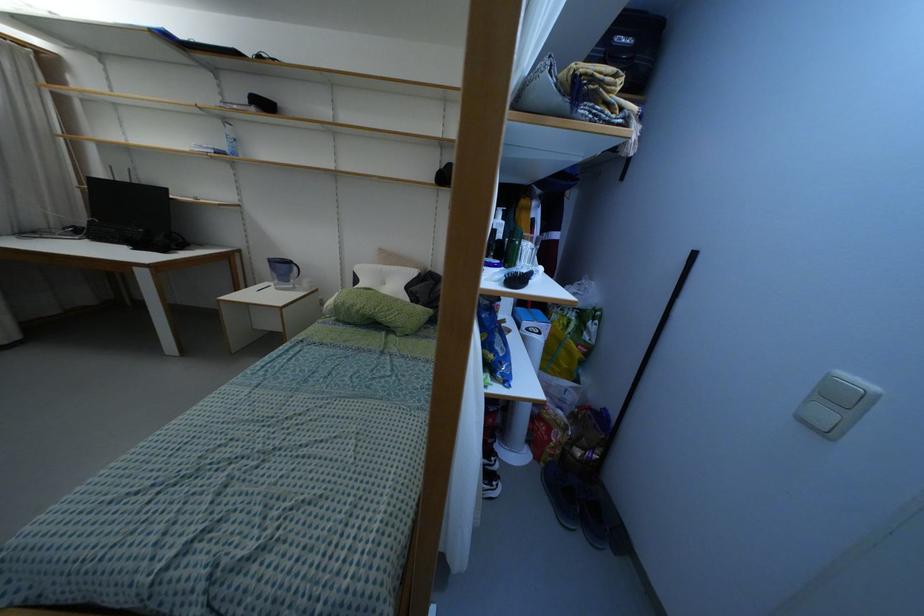
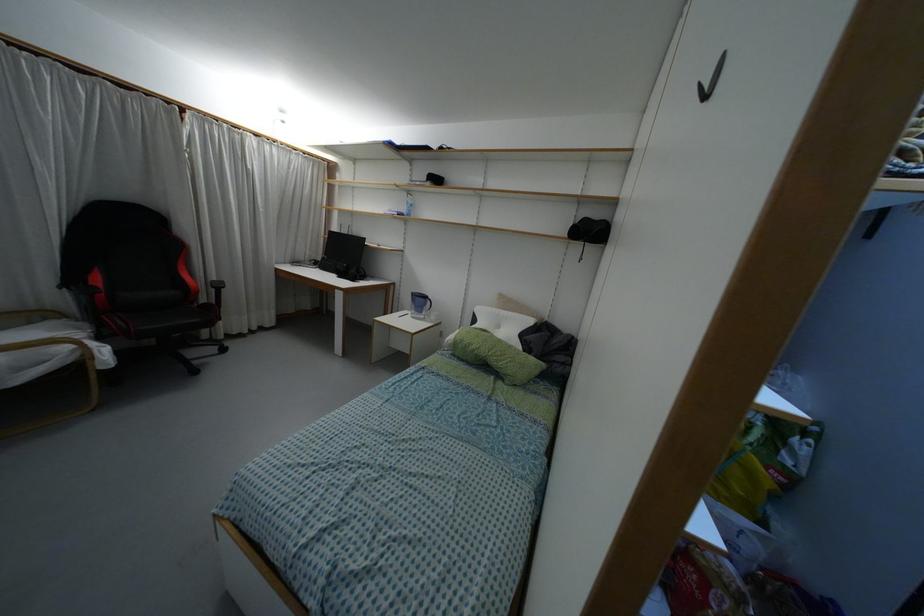
Locate, in the second image, the point that corresponds to [295,268] in the first image.

(428, 302)